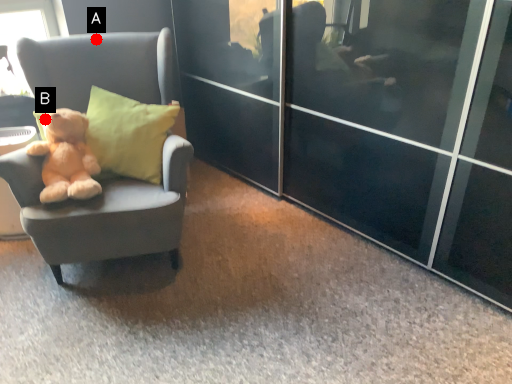
Question: Two points are circled on the image, labeled by A and B beside each circle. Which of the following is the closest to the observer?

Choices:
 (A) A is closer
 (B) B is closer

Answer: (B)